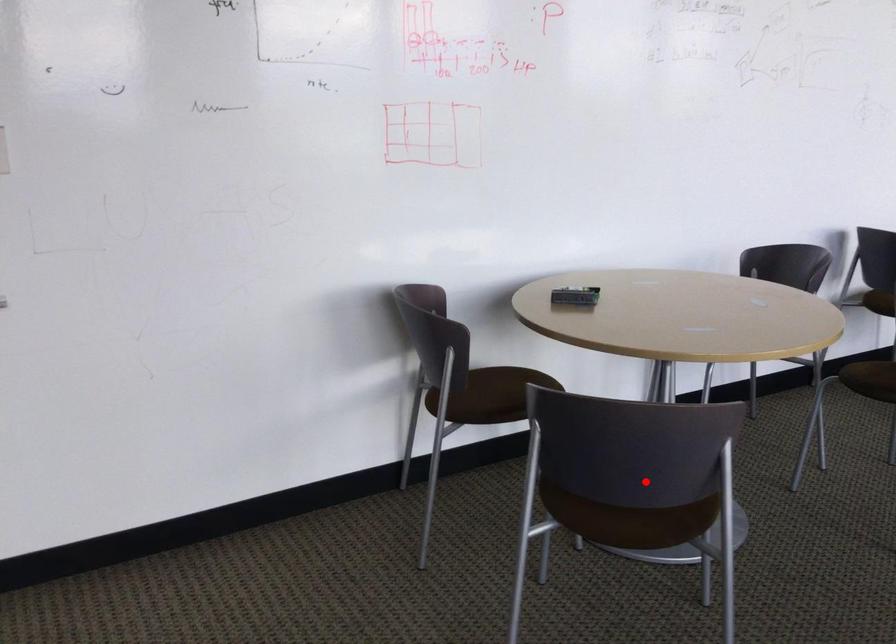
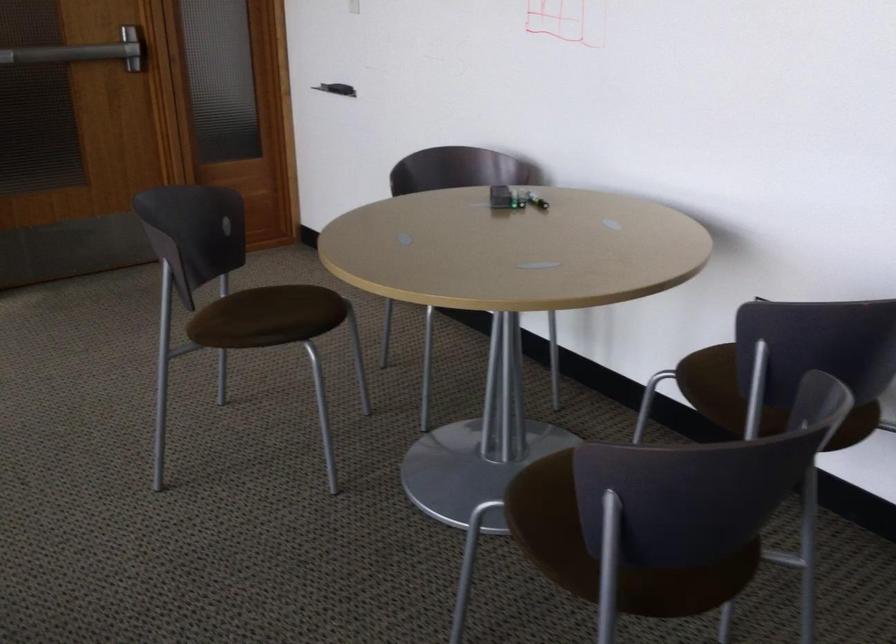
Question: I am providing you with two images of the same scene from different viewpoints. Image1 has a red point marked. In image2, the corresponding 3D location appears at what relative position? Reply with the corresponding letter.

Choices:
 (A) Closer
 (B) Farther

Answer: (B)